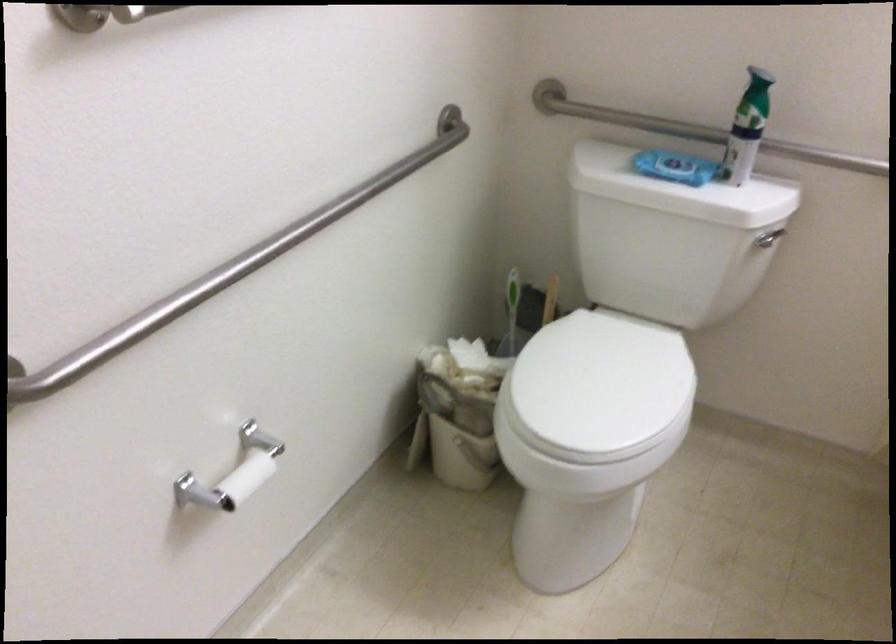
Describe the element at coordinates (678, 190) in the screenshot. I see `a white toilet tank lid` at that location.